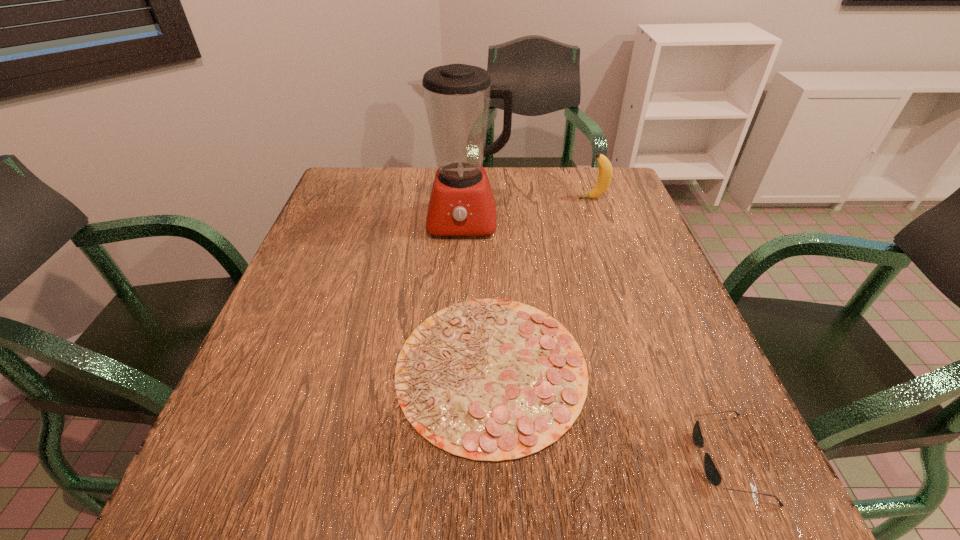
This screenshot has height=540, width=960. Identify the location of free space located on the right of the pizza. (637, 368).

Locate an element on the screen. The image size is (960, 540). free location located 0.270m on the lenses of the sunglasses is located at coordinates (534, 458).

The height and width of the screenshot is (540, 960). What are the coordinates of `free space located 0.140m on the lenses of the sunglasses` in the screenshot? It's located at (612, 458).

You are a GUI agent. You are given a task and a screenshot of the screen. Output one action in this format:
    pyautogui.click(x=<x>, y=<y>)
    Task: Click on the free spot located 0.110m on the lenses of the sunglasses
    This screenshot has width=960, height=540.
    Given the screenshot: What is the action you would take?
    pyautogui.click(x=631, y=458)

I want to click on blender that is positioned at the far edge, so click(457, 97).

Identify the location of banana that is at the far edge. (605, 168).

What are the coordinates of `object that is positioned at the near edge` in the screenshot? It's located at (711, 471).

Locate an element on the screen. banana present at the right edge is located at coordinates (605, 168).

Locate an element on the screen. Image resolution: width=960 pixels, height=540 pixels. sunglasses that is at the right edge is located at coordinates (711, 471).

At what (x,y) coordinates should I click in order to perform the action: click on object that is at the far right corner. Please return your answer as a coordinate pair (x, y). The image size is (960, 540). Looking at the image, I should click on coord(605,168).